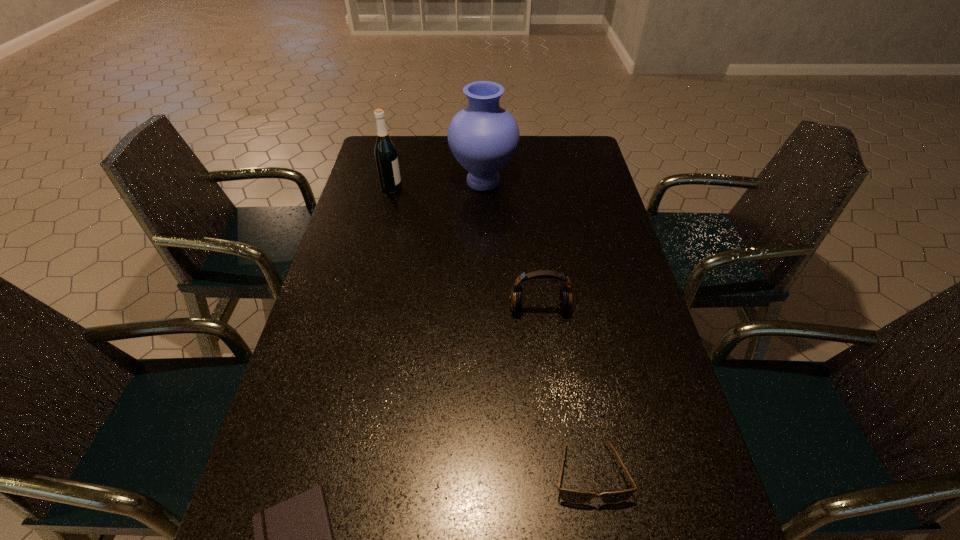
In order to click on free space between the fourth tallest object and the vase in this screenshot , I will do `click(537, 327)`.

Find the location of a particular element. The image size is (960, 540). object that stands as the closest to the sunglasses is located at coordinates (565, 299).

You are a GUI agent. You are given a task and a screenshot of the screen. Output one action in this format:
    pyautogui.click(x=<x>, y=<y>)
    Task: Click on the object that is the fourth closest to the fourth shortest object
    
    Given the screenshot: What is the action you would take?
    pyautogui.click(x=570, y=496)